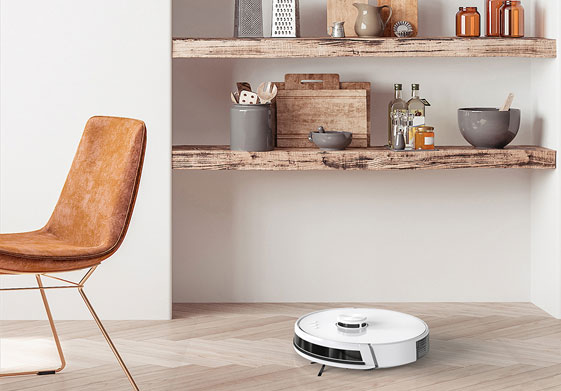
Locate an element on the screen. shelf is located at coordinates (443, 151).